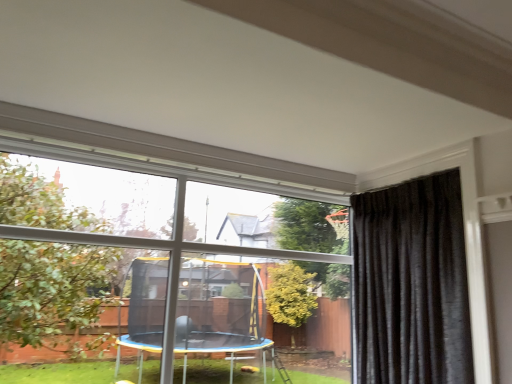
Locate an element on the screen. black velvet curtain at right is located at coordinates (412, 283).

The image size is (512, 384). Describe the element at coordinates (412, 283) in the screenshot. I see `black velvet curtain at right` at that location.

What do you see at coordinates (178, 246) in the screenshot?
I see `clear glass window at center` at bounding box center [178, 246].

What is the approximate height of clear glass window at center?

The height of clear glass window at center is 1.41 meters.

This screenshot has width=512, height=384. What are the coordinates of `clear glass window at center` in the screenshot? It's located at (178, 246).

Locate an element on the screen. This screenshot has height=384, width=512. black velvet curtain at right is located at coordinates (412, 283).

Does clear glass window at center appear on the left side of black velvet curtain at right?

Correct, you'll find clear glass window at center to the left of black velvet curtain at right.

Between clear glass window at center and black velvet curtain at right, which one is positioned behind?

black velvet curtain at right is more distant.

Which point is more distant from viewer, (80, 271) or (457, 206)?

The point (80, 271) is farther from the camera.

From the image's perspective, is clear glass window at center above or below black velvet curtain at right?

Based on their image positions, clear glass window at center is located above black velvet curtain at right.

From a real-world perspective, is clear glass window at center physically above black velvet curtain at right?

No.

Considering the sizes of objects clear glass window at center and black velvet curtain at right in the image provided, who is thinner, clear glass window at center or black velvet curtain at right?

clear glass window at center is thinner.

Does clear glass window at center have a greater height compared to black velvet curtain at right?

Correct, clear glass window at center is much taller as black velvet curtain at right.

Considering the relative sizes of clear glass window at center and black velvet curtain at right in the image provided, is clear glass window at center bigger than black velvet curtain at right?

Indeed, clear glass window at center has a larger size compared to black velvet curtain at right.

Is clear glass window at center spatially inside black velvet curtain at right, or outside of it?

clear glass window at center is not inside black velvet curtain at right, it's outside.

Is clear glass window at center next to black velvet curtain at right and touching it?

No, clear glass window at center is not with black velvet curtain at right.

Is clear glass window at center facing towards black velvet curtain at right?

Yes, clear glass window at center faces towards black velvet curtain at right.

Looking at this image, what's the angular difference between clear glass window at center and black velvet curtain at right's facing directions?

The angular difference between clear glass window at center and black velvet curtain at right is 90 degrees.

Measure the distance between clear glass window at center and black velvet curtain at right.

clear glass window at center and black velvet curtain at right are 1.21 meters apart.

This screenshot has width=512, height=384. Find the location of `curtain on the right of clear glass window at center`. curtain on the right of clear glass window at center is located at coordinates (412, 283).

Is black velvet curtain at right to the right of clear glass window at center from the viewer's perspective?

Yes.

Is black velvet curtain at right further to the viewer compared to clear glass window at center?

That is True.

Is point (378, 306) farther from viewer compared to point (56, 212)?

No, (378, 306) is closer to viewer.

From the image's perspective, is black velvet curtain at right positioned above or below clear glass window at center?

black velvet curtain at right is situated lower than clear glass window at center in the image.

From a real-world perspective, who is located higher, black velvet curtain at right or clear glass window at center?

black velvet curtain at right.

Can you confirm if black velvet curtain at right is thinner than clear glass window at center?

Incorrect, the width of black velvet curtain at right is not less than that of clear glass window at center.

Who is taller, black velvet curtain at right or clear glass window at center?

clear glass window at center is taller.

Is black velvet curtain at right bigger or smaller than clear glass window at center?

In the image, black velvet curtain at right appears to be smaller than clear glass window at center.

Choose the correct answer: Is black velvet curtain at right inside clear glass window at center or outside it?

black velvet curtain at right exists outside the volume of clear glass window at center.

Is black velvet curtain at right far away from clear glass window at center?

black velvet curtain at right is far away from clear glass window at center.

Is black velvet curtain at right oriented towards clear glass window at center?

Yes, black velvet curtain at right faces towards clear glass window at center.

How many degrees apart are the facing directions of black velvet curtain at right and clear glass window at center?

The facing directions of black velvet curtain at right and clear glass window at center are 90 degrees apart.

Where is `curtain that is below the clear glass window at center (from the image's perspective)`? curtain that is below the clear glass window at center (from the image's perspective) is located at coordinates (412, 283).

This screenshot has height=384, width=512. In order to click on curtain above the clear glass window at center (from a real-world perspective) in this screenshot , I will do `click(412, 283)`.

The width and height of the screenshot is (512, 384). Identify the location of window lying on the left of black velvet curtain at right. (178, 246).